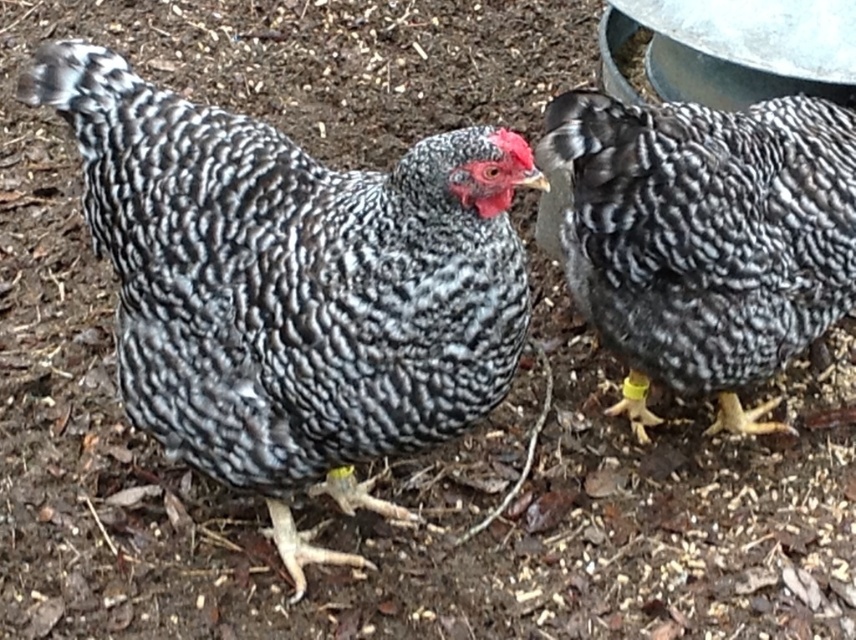
Question: Which object appears farthest from the camera in this image?

Choices:
 (A) speckled feathered chicken at right
 (B) speckled feathered chicken at center

Answer: (A)

Question: Is speckled feathered chicken at center positioned at the back of speckled feathered chicken at right?

Choices:
 (A) no
 (B) yes

Answer: (A)

Question: Is speckled feathered chicken at center below speckled feathered chicken at right?

Choices:
 (A) yes
 (B) no

Answer: (A)

Question: Can you confirm if speckled feathered chicken at center is bigger than speckled feathered chicken at right?

Choices:
 (A) yes
 (B) no

Answer: (A)